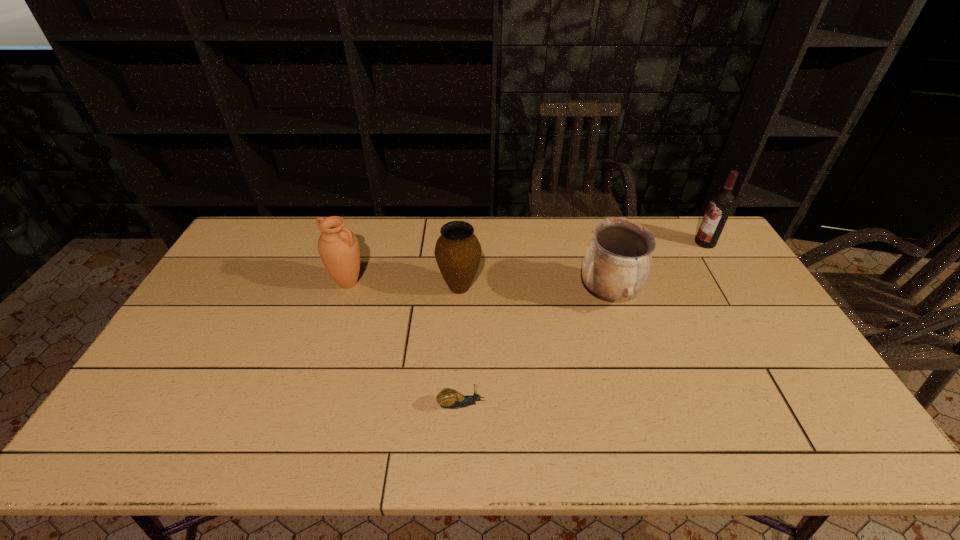
Where is `free space located on the front of the leftmost object`? free space located on the front of the leftmost object is located at coordinates (339, 309).

Image resolution: width=960 pixels, height=540 pixels. I want to click on vacant region located 0.210m on the left of the rightmost urn, so click(512, 293).

Identify the location of free space located 0.350m on the left of the second urn from left to right. (328, 287).

Locate an element on the screen. free space located 0.290m on the front-facing side of the nearest object is located at coordinates (601, 404).

This screenshot has width=960, height=540. Find the location of `object located at the far edge`. object located at the far edge is located at coordinates (721, 203).

Identify the location of object that is positioned at the right edge. (721, 203).

I want to click on object at the far right corner, so click(721, 203).

In the image, there is a desktop. Where is `vacant space at the far edge`? The image size is (960, 540). vacant space at the far edge is located at coordinates (492, 224).

Locate an element on the screen. free space at the near edge of the desktop is located at coordinates (302, 456).

Where is `vacant region at the left edge of the desktop`? Image resolution: width=960 pixels, height=540 pixels. vacant region at the left edge of the desktop is located at coordinates (245, 277).